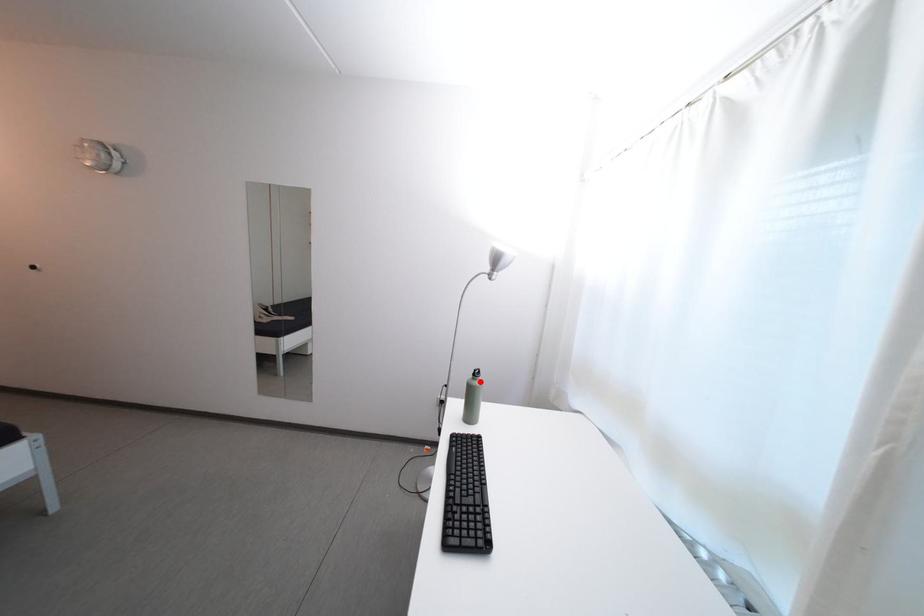
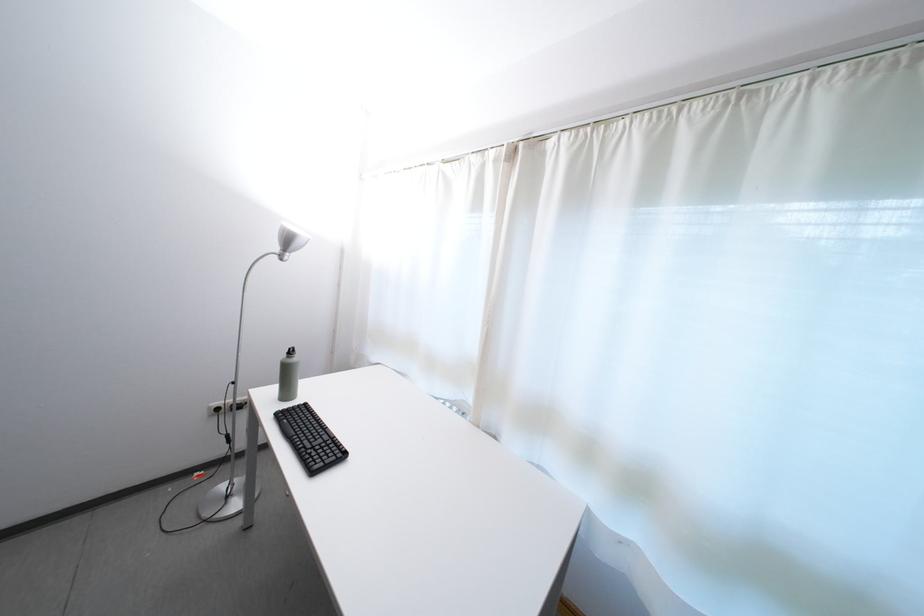
The point at the highlighted location is marked in the first image. Where is the corresponding point in the second image?

(294, 361)